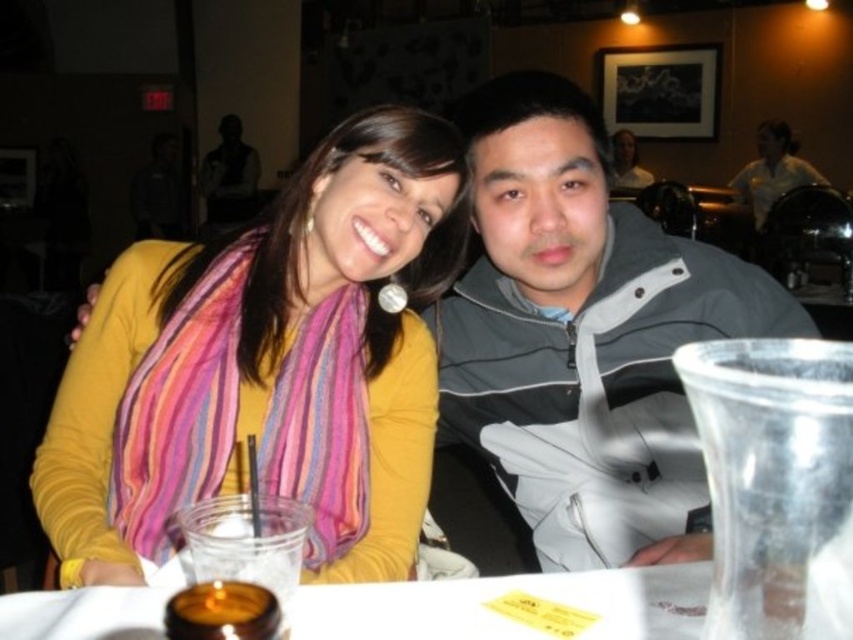
Is white paper table at center positioned in front of dark gray vest at upper left?

Yes.

Is point (608, 582) behind point (244, 179)?

No, (608, 582) is in front of (244, 179).

Is point (326, 634) closer to viewer compared to point (236, 124)?

Yes, point (326, 634) is closer to viewer.

Image resolution: width=853 pixels, height=640 pixels. I want to click on white paper table at center, so point(514,605).

What do you see at coordinates (180, 408) in the screenshot? The image size is (853, 640). I see `multicolored silky scarf at center` at bounding box center [180, 408].

From the picture: Which of these two, multicolored silky scarf at center or dark gray vest at upper left, stands shorter?

Standing shorter between the two is multicolored silky scarf at center.

Between point (189, 396) and point (224, 192), which one is positioned behind?

The point (224, 192) is more distant.

You are a GUI agent. You are given a task and a screenshot of the screen. Output one action in this format:
    pyautogui.click(x=<x>, y=<y>)
    Task: Click on the multicolored silky scarf at center
    Image resolution: width=853 pixels, height=640 pixels.
    Given the screenshot: What is the action you would take?
    pyautogui.click(x=180, y=408)

In order to click on gray matte jacket at center in this screenshot , I will do `click(583, 333)`.

Identify the location of gray matte jacket at center. The width and height of the screenshot is (853, 640). (583, 333).